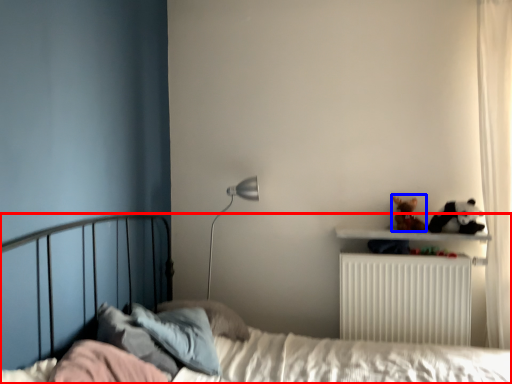
Question: Which point is further to the camera, bed (highlighted by a red box) or toy (highlighted by a blue box)?

Choices:
 (A) bed
 (B) toy

Answer: (B)